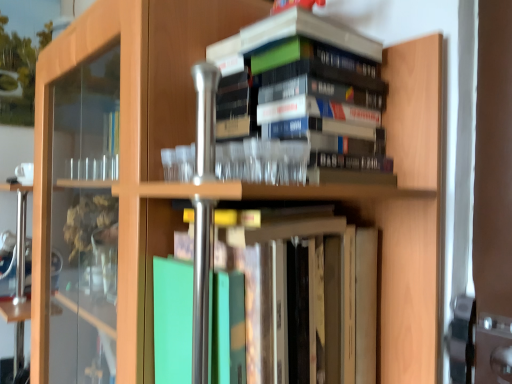
What do you see at coordinates (294, 301) in the screenshot? The image size is (512, 384). I see `green matte book at center, arranged as the second book when viewed from the top` at bounding box center [294, 301].

Locate an element on the screen. The width and height of the screenshot is (512, 384). green matte book at center, arranged as the second book when viewed from the top is located at coordinates (294, 301).

What do you see at coordinates (300, 84) in the screenshot? I see `hardcover books at upper center, which is the 2th book in bottom-to-top order` at bounding box center [300, 84].

Measure the distance between point (x=298, y=54) and camera.

61.40 centimeters.

Where is `hardcover books at upper center, which is the 2th book in bottom-to-top order`? Image resolution: width=512 pixels, height=384 pixels. hardcover books at upper center, which is the 2th book in bottom-to-top order is located at coordinates (300, 84).

I want to click on green matte book at center, acting as the first book starting from the bottom, so click(x=294, y=301).

In the scene shown: In the image, is green matte book at center, arranged as the second book when viewed from the top, on the left side or the right side of hardcover books at upper center, the 1th book viewed from the top?

green matte book at center, arranged as the second book when viewed from the top, is positioned on hardcover books at upper center, the 1th book viewed from the top,'s left side.

Which object is further away from the camera taking this photo, green matte book at center, arranged as the second book when viewed from the top, or hardcover books at upper center, which is the 2th book in bottom-to-top order?

hardcover books at upper center, which is the 2th book in bottom-to-top order, is further away from the camera.

Does point (348, 314) come closer to viewer compared to point (350, 89)?

No, (348, 314) is further to viewer.

From the image's perspective, is green matte book at center, arranged as the second book when viewed from the top, located above or below hardcover books at upper center, the 1th book viewed from the top?

Clearly, from the image's perspective, green matte book at center, arranged as the second book when viewed from the top, is below hardcover books at upper center, the 1th book viewed from the top.

From a real-world perspective, which object rests below the other?

From a 3D spatial view, green matte book at center, arranged as the second book when viewed from the top, is below.

Can you confirm if green matte book at center, acting as the first book starting from the bottom, is thinner than hardcover books at upper center, the 1th book viewed from the top?

In fact, green matte book at center, acting as the first book starting from the bottom, might be wider than hardcover books at upper center, the 1th book viewed from the top.

Based on the photo, considering the sizes of objects green matte book at center, arranged as the second book when viewed from the top, and hardcover books at upper center, the 1th book viewed from the top, in the image provided, who is shorter, green matte book at center, arranged as the second book when viewed from the top, or hardcover books at upper center, the 1th book viewed from the top,?

Standing shorter between the two is hardcover books at upper center, the 1th book viewed from the top.

Between green matte book at center, arranged as the second book when viewed from the top, and hardcover books at upper center, the 1th book viewed from the top, which one has smaller size?

Smaller between the two is hardcover books at upper center, the 1th book viewed from the top.

Choose the correct answer: Is green matte book at center, arranged as the second book when viewed from the top, inside hardcover books at upper center, the 1th book viewed from the top, or outside it?

green matte book at center, arranged as the second book when viewed from the top, is spatially situated outside hardcover books at upper center, the 1th book viewed from the top.

Is green matte book at center, acting as the first book starting from the bottom, far away from hardcover books at upper center, which is the 2th book in bottom-to-top order?

They are positioned close to each other.

Is green matte book at center, acting as the first book starting from the bottom, oriented towards hardcover books at upper center, the 1th book viewed from the top?

No.

How many degrees apart are the facing directions of green matte book at center, arranged as the second book when viewed from the top, and hardcover books at upper center, the 1th book viewed from the top?

The angle between the facing direction of green matte book at center, arranged as the second book when viewed from the top, and the facing direction of hardcover books at upper center, the 1th book viewed from the top, is 0.869 degrees.

In the image, there is a hardcover books at upper center, the 1th book viewed from the top. Find the location of `book below it (from a real-world perspective)`. book below it (from a real-world perspective) is located at coordinates (294, 301).

Is hardcover books at upper center, which is the 2th book in bottom-to-top order, to the left of green matte book at center, arranged as the second book when viewed from the top, from the viewer's perspective?

No.

Which object is closer to the camera taking this photo, hardcover books at upper center, the 1th book viewed from the top, or green matte book at center, arranged as the second book when viewed from the top?

green matte book at center, arranged as the second book when viewed from the top.

Which is behind, point (348, 33) or point (177, 355)?

Point (348, 33)

From the image's perspective, between hardcover books at upper center, the 1th book viewed from the top, and green matte book at center, acting as the first book starting from the bottom, who is located below?

green matte book at center, acting as the first book starting from the bottom, is shown below in the image.

From a real-world perspective, does hardcover books at upper center, which is the 2th book in bottom-to-top order, sit lower than green matte book at center, acting as the first book starting from the bottom?

Actually, hardcover books at upper center, which is the 2th book in bottom-to-top order, is physically above green matte book at center, acting as the first book starting from the bottom, in the real world.

Can you confirm if hardcover books at upper center, which is the 2th book in bottom-to-top order, is wider than green matte book at center, acting as the first book starting from the bottom?

In fact, hardcover books at upper center, which is the 2th book in bottom-to-top order, might be narrower than green matte book at center, acting as the first book starting from the bottom.

Which of these two, hardcover books at upper center, the 1th book viewed from the top, or green matte book at center, acting as the first book starting from the bottom, stands taller?

Standing taller between the two is green matte book at center, acting as the first book starting from the bottom.

Who is smaller, hardcover books at upper center, which is the 2th book in bottom-to-top order, or green matte book at center, acting as the first book starting from the bottom?

hardcover books at upper center, which is the 2th book in bottom-to-top order, is smaller.

Is hardcover books at upper center, which is the 2th book in bottom-to-top order, positioned beyond the bounds of green matte book at center, arranged as the second book when viewed from the top?

Absolutely, hardcover books at upper center, which is the 2th book in bottom-to-top order, is external to green matte book at center, arranged as the second book when viewed from the top.

Is hardcover books at upper center, which is the 2th book in bottom-to-top order, turned away from green matte book at center, acting as the first book starting from the bottom?

hardcover books at upper center, which is the 2th book in bottom-to-top order, is not turned away from green matte book at center, acting as the first book starting from the bottom.

The image size is (512, 384). I want to click on book above the green matte book at center, arranged as the second book when viewed from the top (from a real-world perspective), so click(300, 84).

Where is `book that is on the right side of green matte book at center, arranged as the second book when viewed from the top`? book that is on the right side of green matte book at center, arranged as the second book when viewed from the top is located at coordinates (300, 84).

Where is `book that appears on the left of hardcover books at upper center, the 1th book viewed from the top`? book that appears on the left of hardcover books at upper center, the 1th book viewed from the top is located at coordinates (294, 301).